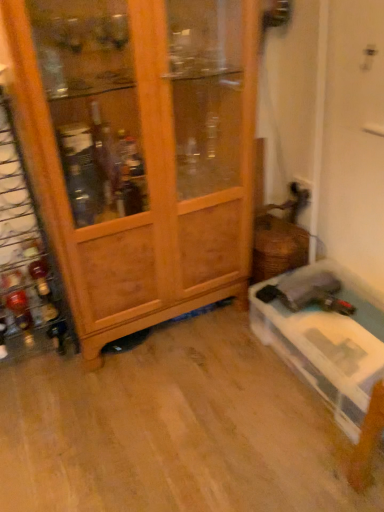
Locate an element on the screen. free location in front of wooden wine rack at left is located at coordinates (40, 395).